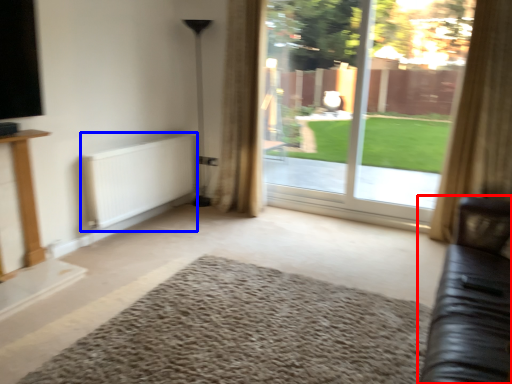
Question: Which object is closer to the camera taking this photo, studio couch (highlighted by a red box) or radiator (highlighted by a blue box)?

Choices:
 (A) studio couch
 (B) radiator

Answer: (A)